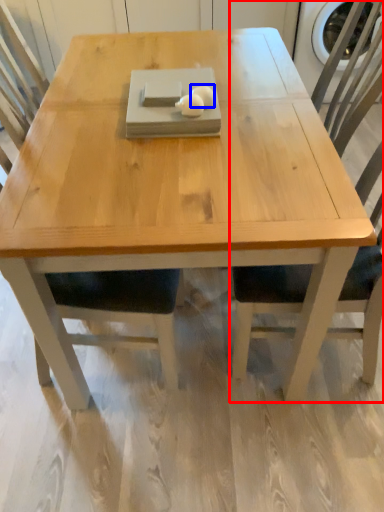
Question: Among these objects, which one is farthest to the camera, chair (highlighted by a red box) or food (highlighted by a blue box)?

Choices:
 (A) chair
 (B) food

Answer: (B)